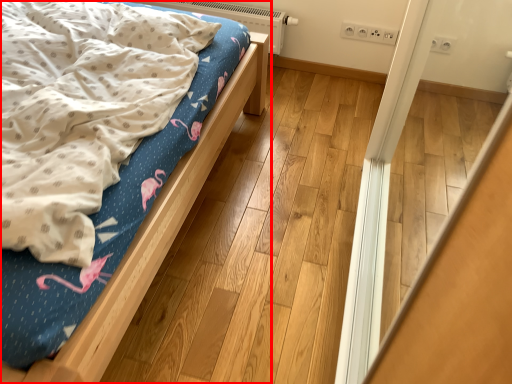
Question: In this image, where is bed (annotated by the red box) located relative to heater?

Choices:
 (A) right
 (B) left

Answer: (B)